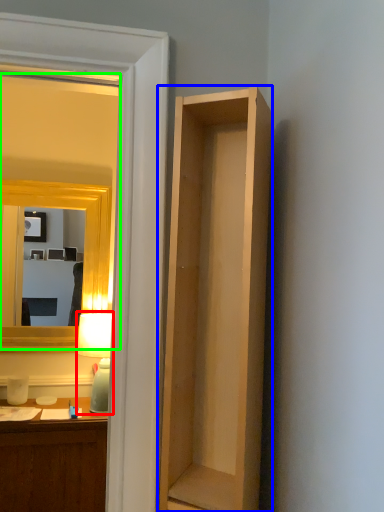
Question: Which object is positioned closest to lamp (highlighted by a red box)? Select from cabinetry (highlighted by a blue box) and mirror (highlighted by a green box).

Choices:
 (A) cabinetry
 (B) mirror

Answer: (B)